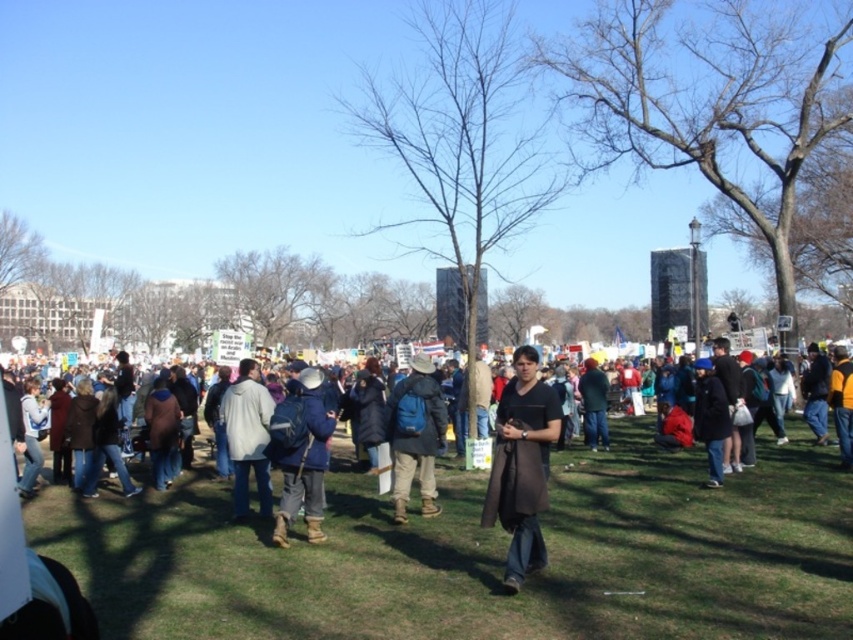
Question: Estimate the real-world distances between objects in this image. Which object is farther from the blue fabric jacket at center?

Choices:
 (A) green grass at center
 (B) dark brown leather jacket at center
 (C) light beige coat at center
 (D) dark blue fabric jacket at center

Answer: (B)

Question: Is green grass at center thinner than blue fabric jacket at center?

Choices:
 (A) no
 (B) yes

Answer: (A)

Question: Considering the relative positions of dark blue fabric jacket at center and dark brown leather jacket at center in the image provided, where is dark blue fabric jacket at center located with respect to dark brown leather jacket at center?

Choices:
 (A) above
 (B) below

Answer: (A)

Question: Is blue backpack at center smaller than dark brown leather jacket at center?

Choices:
 (A) no
 (B) yes

Answer: (A)

Question: Which of the following is the closest to the observer?

Choices:
 (A) light beige coat at center
 (B) dark blue fabric jacket at center
 (C) blue fabric jacket at center

Answer: (C)

Question: Which of these objects is positioned closest to the blue fabric jacket at center?

Choices:
 (A) blue backpack at center
 (B) light beige coat at center

Answer: (B)